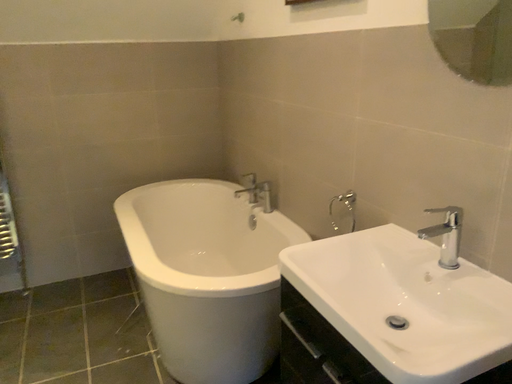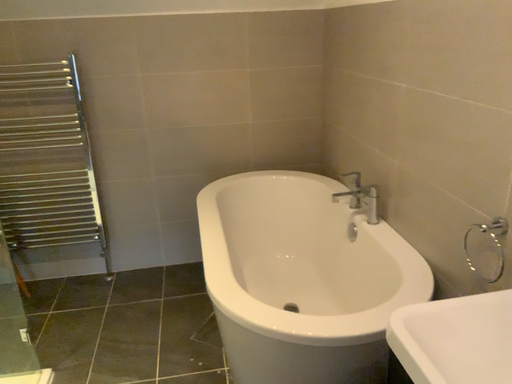
Question: Which way did the camera rotate in the video?

Choices:
 (A) rotated left
 (B) rotated right

Answer: (A)